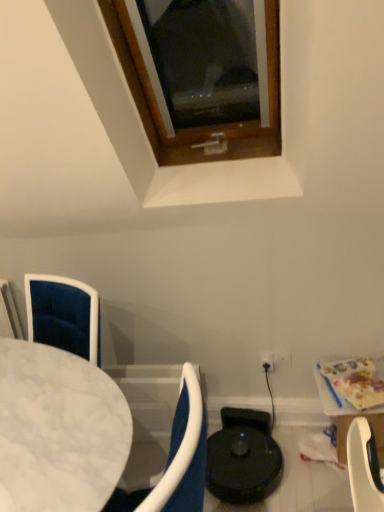
Measure the distance between point (69, 387) and camera.

1.28 meters.

Describe the element at coordinates (59, 430) in the screenshot. The height and width of the screenshot is (512, 384). I see `white marble table at lower left` at that location.

What is the approximate width of white marble table at lower left?

17.27 inches.

This screenshot has width=384, height=512. Identify the location of white marble table at lower left. (59, 430).

What are the coordinates of `white marble table at lower left` in the screenshot? It's located at (59, 430).